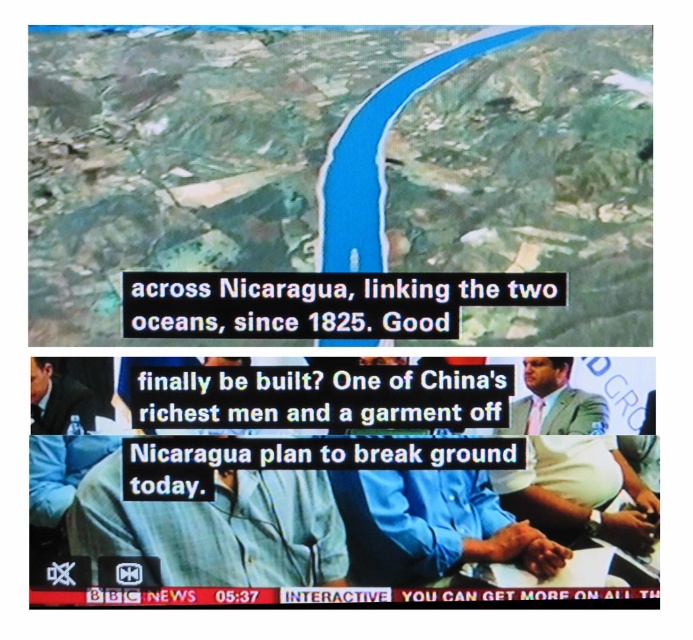
Based on the photo, is light blue suit at right bigger than light blue shirt at left?

Indeed, light blue suit at right has a larger size compared to light blue shirt at left.

Between light blue suit at right and light blue shirt at left, which one is positioned lower?

light blue suit at right is below.

Find the location of `light blue suit at right`. light blue suit at right is located at coordinates (554, 401).

This screenshot has height=640, width=693. In order to click on light blue suit at right in this screenshot , I will do `click(554, 401)`.